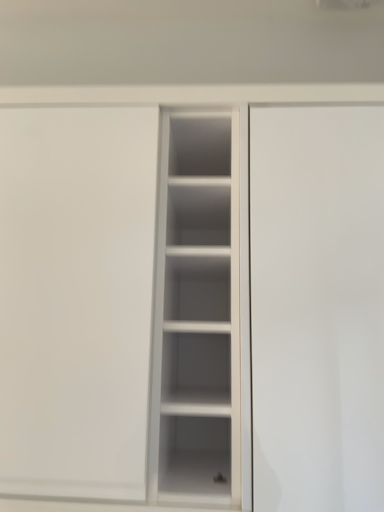
In order to face transparent glass door at center-right, should I rotate leftwards or rightwards?

Rotate right and turn 18.172 degrees.

At what (x,y) coordinates should I click in order to perform the action: click on transparent glass door at center-right. Please return your answer as a coordinate pair (x, y). Image resolution: width=384 pixels, height=512 pixels. Looking at the image, I should click on pos(317,307).

What do you see at coordinates (317, 307) in the screenshot? I see `transparent glass door at center-right` at bounding box center [317, 307].

Measure the distance between point (304,204) and camera.

The distance of point (304,204) from camera is 29.84 inches.

This screenshot has height=512, width=384. I want to click on transparent glass door at center-right, so click(317, 307).